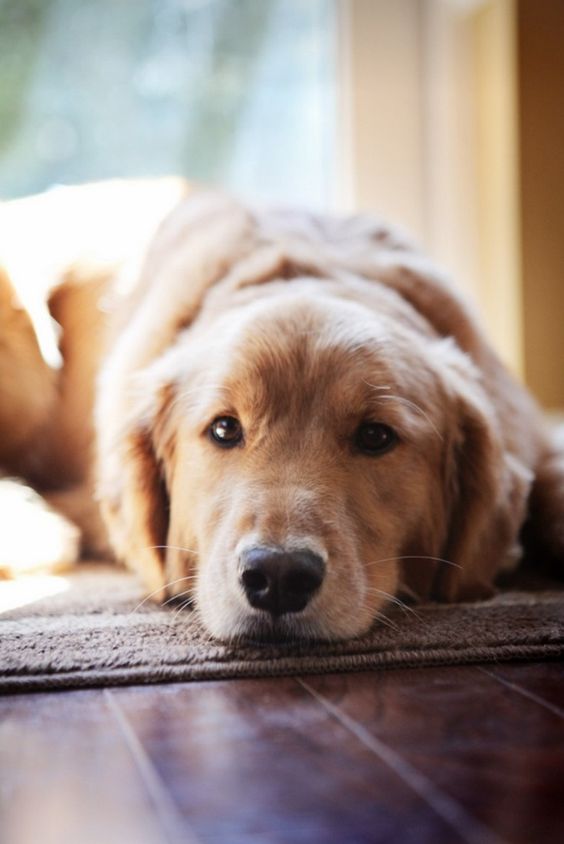
Where is `rug`? This screenshot has height=844, width=564. rug is located at coordinates (88, 630).